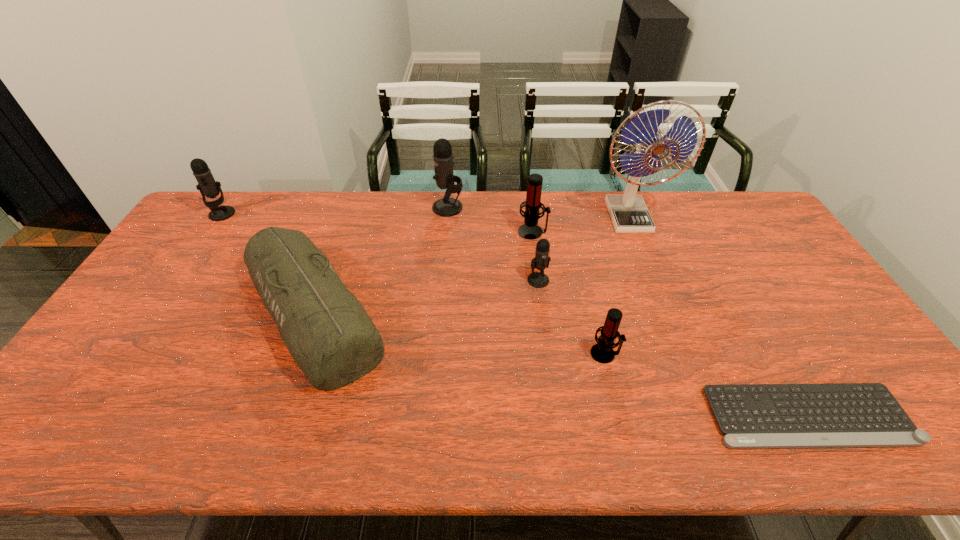
Locate an element on the screen. The width and height of the screenshot is (960, 540). free location located on the left of the second object from left to right is located at coordinates (136, 313).

Image resolution: width=960 pixels, height=540 pixels. I want to click on vacant space located on the right of the fourth farthest microphone, so click(675, 280).

Locate an element on the screen. free space located on the back of the smaller red microphone is located at coordinates (586, 275).

Where is `vacant space located 0.130m on the back of the gray computer keyboard`? vacant space located 0.130m on the back of the gray computer keyboard is located at coordinates (766, 343).

This screenshot has width=960, height=540. In order to click on fan located in the far edge section of the desktop in this screenshot , I will do `click(629, 214)`.

Locate an element on the screen. The height and width of the screenshot is (540, 960). object that is at the near edge is located at coordinates (839, 415).

The width and height of the screenshot is (960, 540). What are the coordinates of `object present at the left edge` in the screenshot? It's located at (208, 187).

Where is `object positioned at the right edge`? object positioned at the right edge is located at coordinates (839, 415).

Where is `object situated at the far left corner`? This screenshot has width=960, height=540. object situated at the far left corner is located at coordinates (208, 187).

Find the location of a particular element. Image resolution: width=960 pixels, height=540 pixels. object positioned at the near right corner is located at coordinates (839, 415).